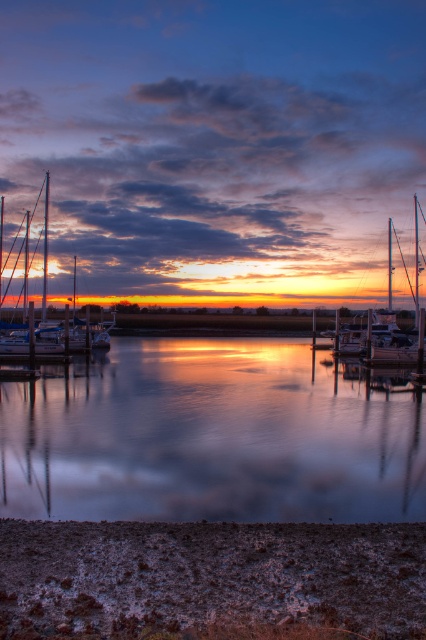
Which is above, frosted grass at lower center or shiny white sailboat at left?

shiny white sailboat at left is higher up.

Consider the image. Can you confirm if frosted grass at lower center is thinner than shiny white sailboat at left?

Correct, frosted grass at lower center's width is less than shiny white sailboat at left's.

Who is more forward, [339,548] or [58,330]?

Point [339,548]

Find the location of `frosted grass at lower center`. frosted grass at lower center is located at coordinates (210, 580).

Which of these two, frosted grass at lower center or white glossy sailboat at center, stands shorter?

With less height is frosted grass at lower center.

Is frosted grass at lower center to the left of white glossy sailboat at center from the viewer's perspective?

Yes, frosted grass at lower center is to the left of white glossy sailboat at center.

Is point (134, 541) in front of point (406, 272)?

Yes, point (134, 541) is in front of point (406, 272).

The height and width of the screenshot is (640, 426). Identify the location of frosted grass at lower center. click(210, 580).

Does glistening water at center have a smaller size compared to white glossy sailboat at center?

Indeed, glistening water at center has a smaller size compared to white glossy sailboat at center.

Can you confirm if glistening water at center is thinner than white glossy sailboat at center?

Correct, glistening water at center's width is less than white glossy sailboat at center's.

In order to click on glistening water at center in this screenshot , I will do `click(212, 436)`.